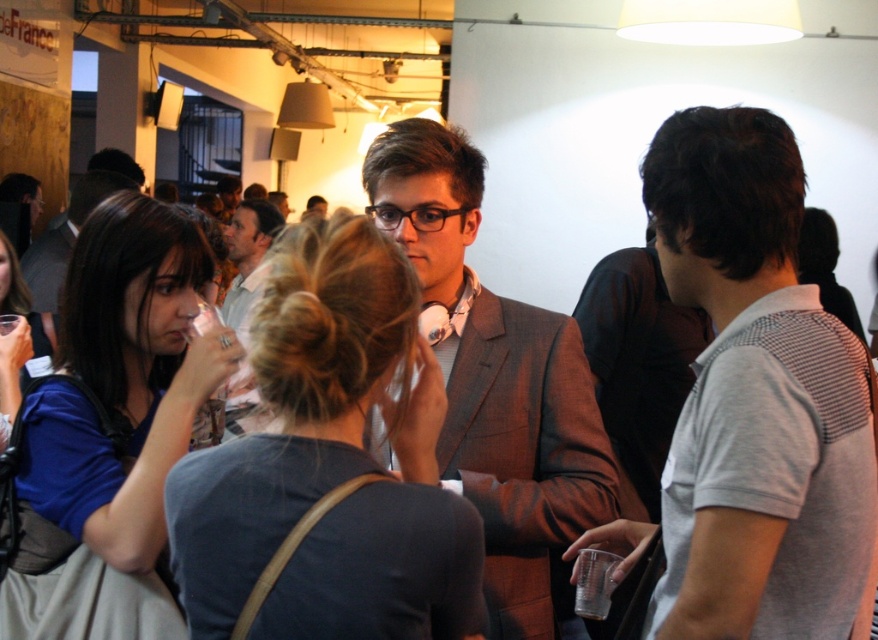
Question: Can you confirm if gray mesh polo shirt at right is thinner than matte black suit at center?

Choices:
 (A) yes
 (B) no

Answer: (A)

Question: Which of these objects is positioned farthest from the gray wool suit at center?

Choices:
 (A) matte white shirt at center
 (B) matte black suit at center

Answer: (A)

Question: Does gray mesh polo shirt at right appear on the left side of gray wool suit at center?

Choices:
 (A) no
 (B) yes

Answer: (A)

Question: Is matte white shirt at center above matte black suit at center?

Choices:
 (A) no
 (B) yes

Answer: (A)

Question: Which of these objects is positioned farthest from the matte black suit at center?

Choices:
 (A) matte white shirt at center
 (B) gray mesh polo shirt at right
 (C) gray wool suit at center

Answer: (B)

Question: Which point is closer to the camera?

Choices:
 (A) matte white shirt at center
 (B) matte black suit at center

Answer: (B)